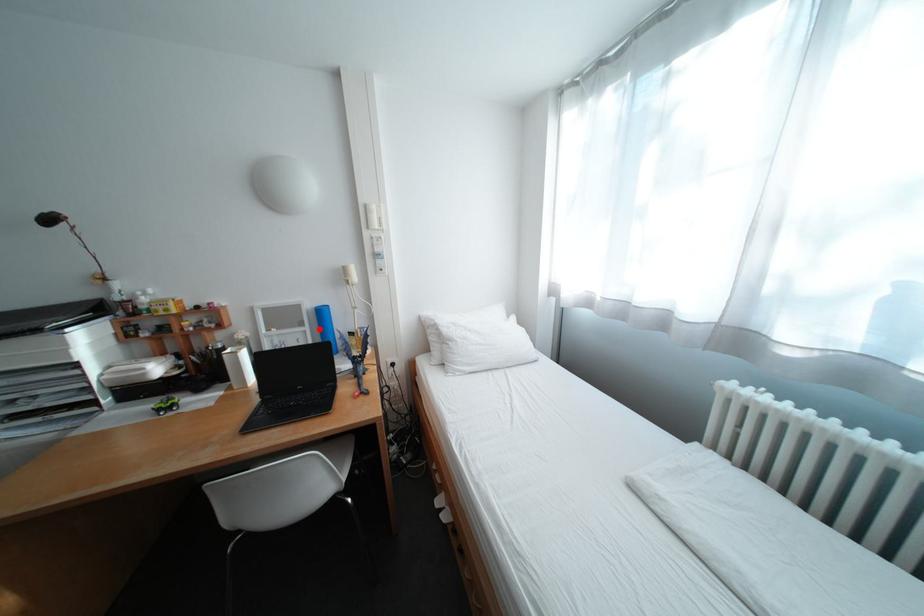
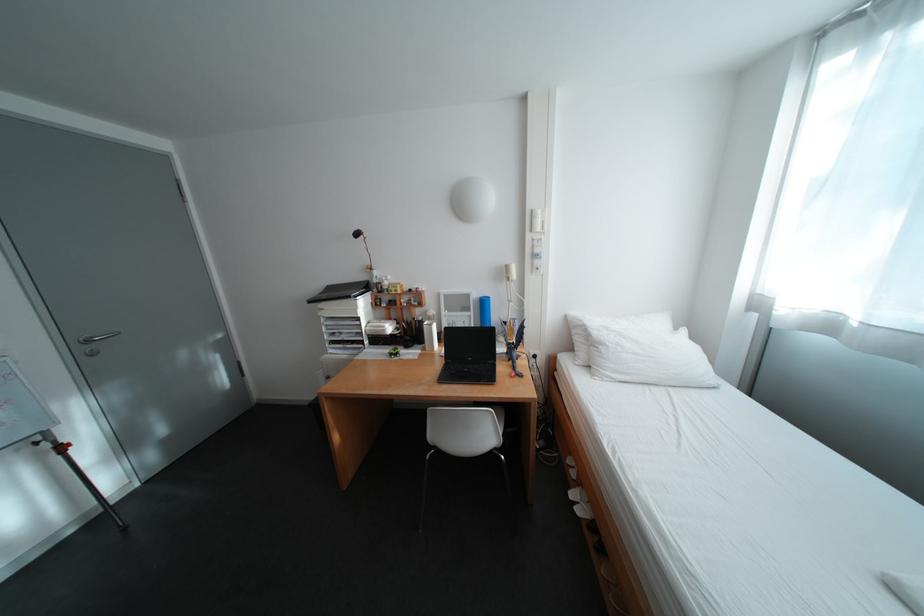
The point at the highlighted location is marked in the first image. Where is the corresponding point in the second image?

(484, 314)